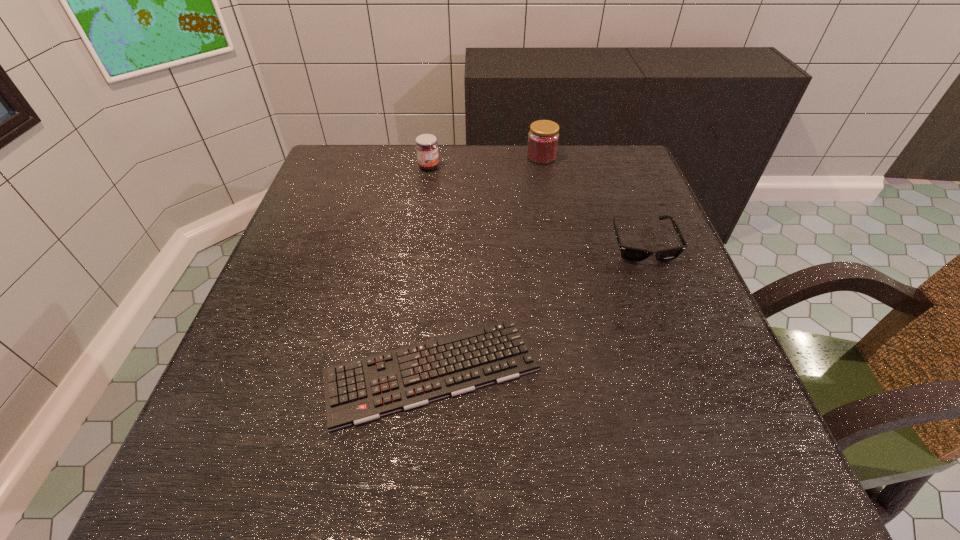
I want to click on the third object from left to right, so click(543, 137).

This screenshot has width=960, height=540. I want to click on the left jam, so click(x=426, y=145).

Image resolution: width=960 pixels, height=540 pixels. I want to click on sunglasses, so click(632, 254).

You are a GUI agent. You are given a task and a screenshot of the screen. Output one action in this format:
    pyautogui.click(x=<x>, y=<y>)
    Task: Click on the rightmost object
    
    Given the screenshot: What is the action you would take?
    pyautogui.click(x=632, y=254)

The width and height of the screenshot is (960, 540). What are the coordinates of `computer keyboard` in the screenshot? It's located at (361, 390).

Find the location of `the shortest object`. the shortest object is located at coordinates (361, 390).

The height and width of the screenshot is (540, 960). Find the location of `free space located on the left of the third object from left to right`. free space located on the left of the third object from left to right is located at coordinates (470, 157).

Image resolution: width=960 pixels, height=540 pixels. Identify the location of vacant region located 0.370m on the front of the left jam. (413, 274).

You are a GUI agent. You are given a task and a screenshot of the screen. Output one action in this format:
    pyautogui.click(x=<x>, y=<y>)
    Task: Click on the free space located on the front-facing side of the sunglasses
    The width and height of the screenshot is (960, 540).
    Given the screenshot: What is the action you would take?
    (699, 393)

Where is `vacant space situated on the back of the computer keyboard`? Image resolution: width=960 pixels, height=540 pixels. vacant space situated on the back of the computer keyboard is located at coordinates (441, 266).